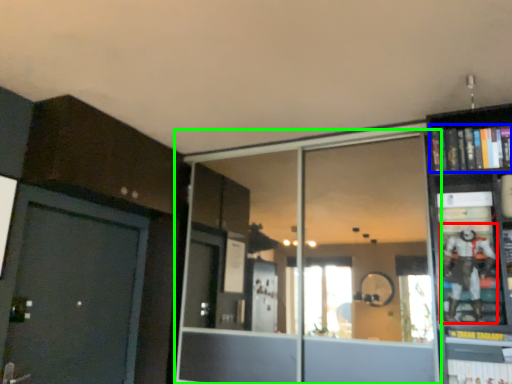
Question: Based on their relative distances, which object is nearer to toy (highlighted by a red box)? Choose from book (highlighted by a blue box) and glass door (highlighted by a green box).

Choices:
 (A) book
 (B) glass door

Answer: (A)